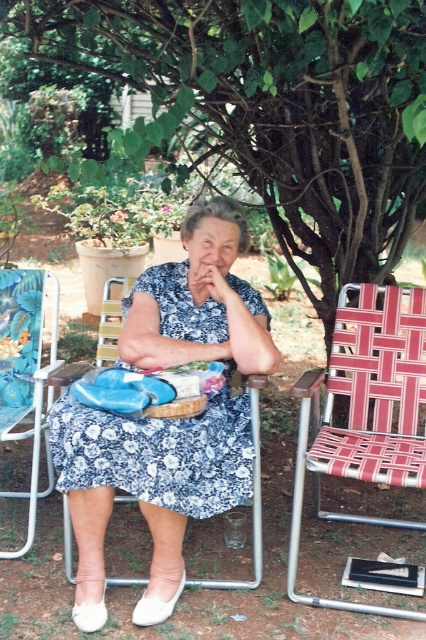
Question: Based on their relative distances, which object is nearer to the green leafy tree at upper center?

Choices:
 (A) red woven fabric folding chair at right
 (B) blue floral dress at center
 (C) blue fabric folding chair at left

Answer: (B)

Question: Which of the following is the closest to the observer?

Choices:
 (A) (356, 362)
 (B) (354, 129)
 (C) (215, 292)

Answer: (C)

Question: Is green leafy tree at upper center to the right of blue fabric folding chair at left from the viewer's perspective?

Choices:
 (A) yes
 (B) no

Answer: (A)

Question: Which of the following is the closest to the observer?

Choices:
 (A) (196, 358)
 (B) (389, 614)
 (C) (5, 552)

Answer: (B)

Question: In this image, where is green leafy tree at upper center located relative to blue floral dress at center?

Choices:
 (A) above
 (B) below

Answer: (A)

Question: Does green leafy tree at upper center appear under blue floral dress at center?

Choices:
 (A) yes
 (B) no

Answer: (B)